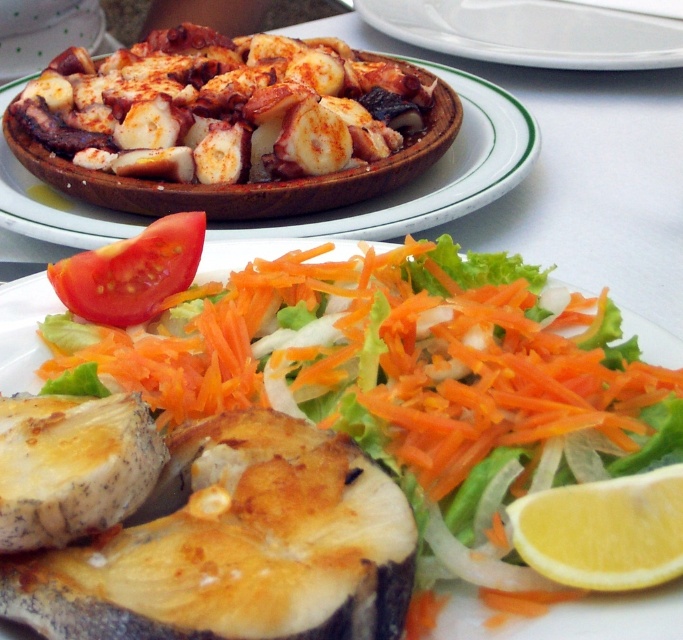
You are a chef preparing a meal and need to place both the white ceramic plate at upper center and the yellow smooth lemon at lower right on a small shelf. The shelf can only hold items that are smaller than 30 cm in diameter. Can both items fit on the shelf?

→ The white ceramic plate at upper center is larger in size than the yellow smooth lemon at lower right. Since the shelf can only hold items smaller than 30 cm in diameter, we need to know the exact sizes of both items. However, the description only states their relative sizes. Without specific measurements, we cannot definitively determine if both will fit. Please provide the actual dimensions for an accurate assessment.